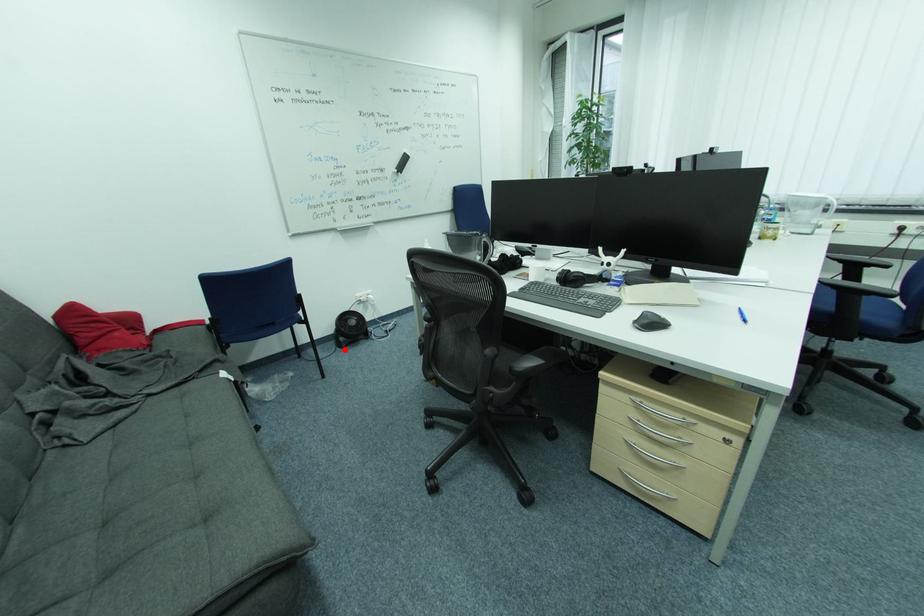
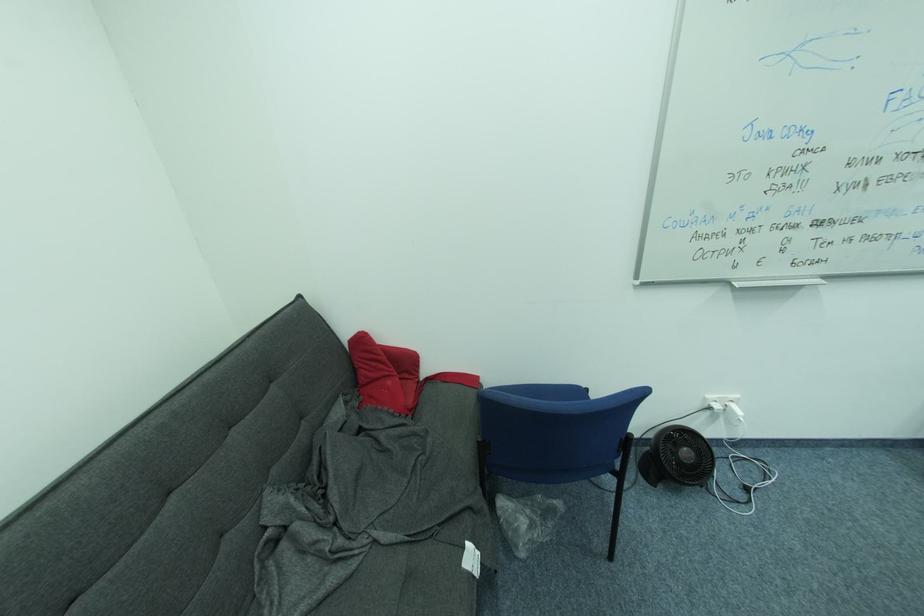
Where in the second image is the point corresponding to the highlighted location from the first image?

(648, 479)